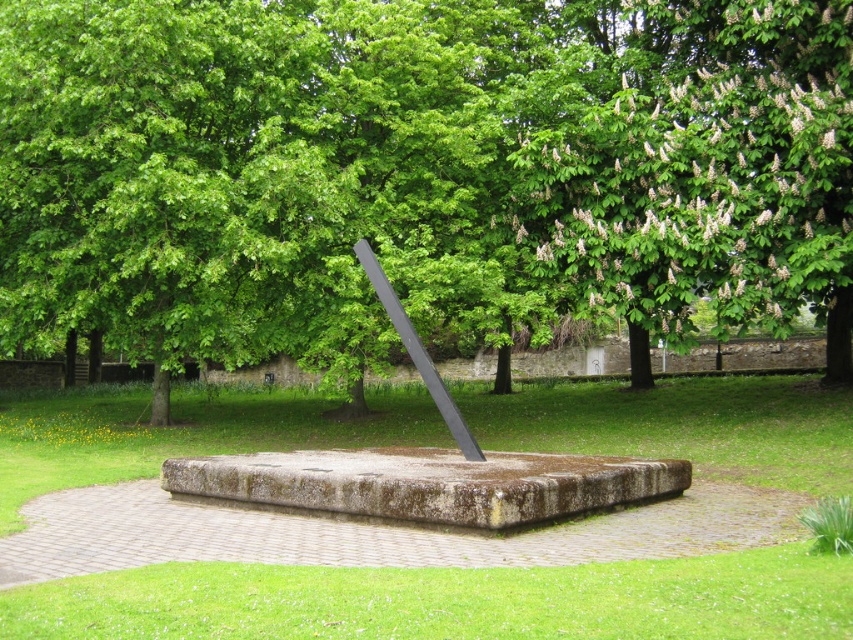
Is green leafy tree at center below green leafy tree at upper right?

Incorrect, green leafy tree at center is not positioned below green leafy tree at upper right.

Where is `green leafy tree at center`? This screenshot has width=853, height=640. green leafy tree at center is located at coordinates (421, 170).

Does point (647, 563) lie behind point (451, 429)?

No, (647, 563) is closer to viewer.

Does rusty concrete sundial at center have a lesser height compared to black polished metal rod at center?

Indeed, rusty concrete sundial at center has a lesser height compared to black polished metal rod at center.

I want to click on rusty concrete sundial at center, so click(451, 600).

You are a GUI agent. You are given a task and a screenshot of the screen. Output one action in this format:
    pyautogui.click(x=<x>, y=<y>)
    Task: Click on the rusty concrete sundial at center
    The height and width of the screenshot is (640, 853).
    Given the screenshot: What is the action you would take?
    pyautogui.click(x=451, y=600)

Who is lower down, green leafy tree at center or black polished metal rod at center?

black polished metal rod at center is lower down.

What do you see at coordinates (421, 170) in the screenshot?
I see `green leafy tree at center` at bounding box center [421, 170].

Where is `green leafy tree at center`? This screenshot has height=640, width=853. green leafy tree at center is located at coordinates (421, 170).